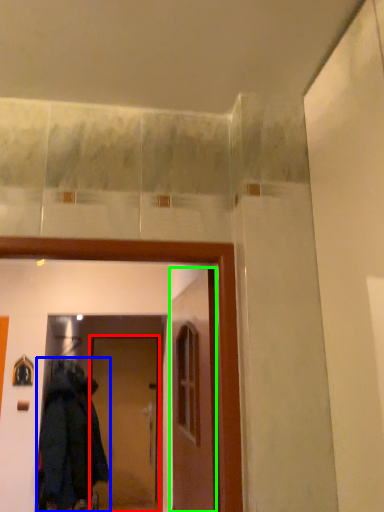
Question: Which is nearer to the door (highlighted by a red box)? coat (highlighted by a blue box) or door (highlighted by a green box).

Choices:
 (A) coat
 (B) door

Answer: (A)